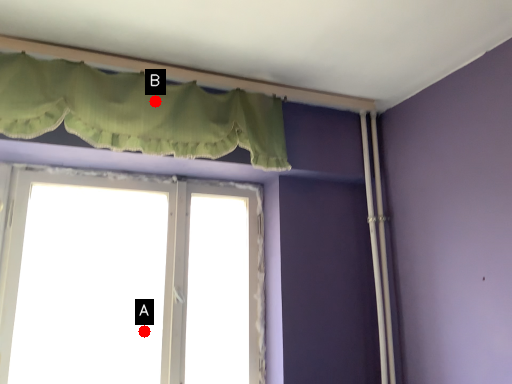
Question: Two points are circled on the image, labeled by A and B beside each circle. Which point appears farthest from the camera in this image?

Choices:
 (A) A is further
 (B) B is further

Answer: (A)